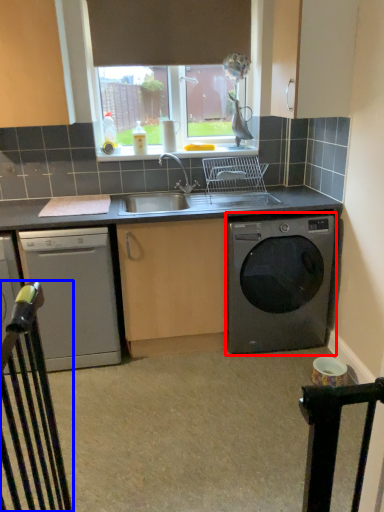
Question: Which point is closer to the camera, washing machine (highlighted by a red box) or rail (highlighted by a blue box)?

Choices:
 (A) washing machine
 (B) rail

Answer: (B)